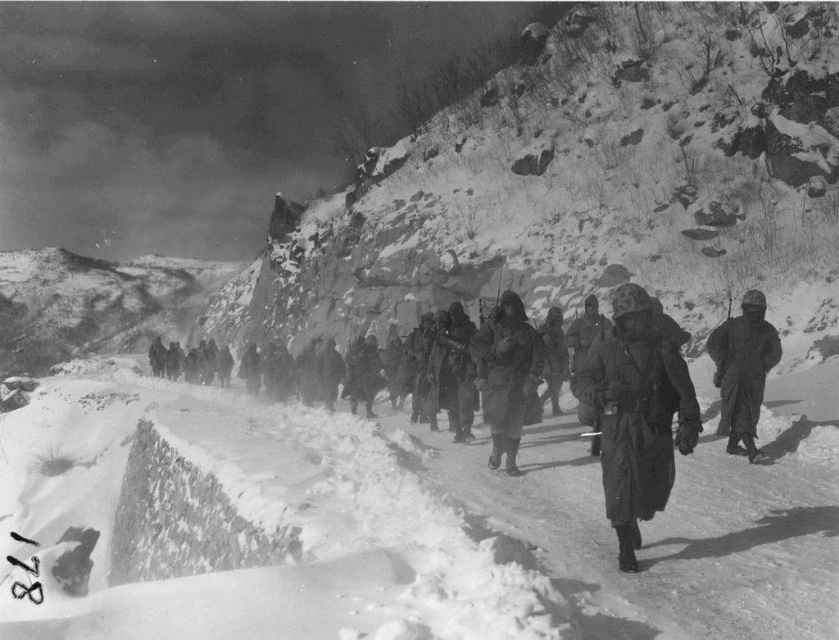
Question: Does white powdery snow at center have a greater width compared to camouflage fabric uniform at center?

Choices:
 (A) yes
 (B) no

Answer: (A)

Question: Does camouflage fabric uniform at center come behind dark gray woolen coat at center?

Choices:
 (A) no
 (B) yes

Answer: (A)

Question: Can you confirm if rocky snow at center is smaller than dark gray woolen coat at center?

Choices:
 (A) no
 (B) yes

Answer: (A)

Question: Estimate the real-world distances between objects in this image. Which object is closer to the camouflage fabric uniform at center?

Choices:
 (A) dark gray woolen coat at center
 (B) rocky snow at center

Answer: (A)

Question: Among these objects, which one is farthest from the camera?

Choices:
 (A) white powdery snow at center
 (B) camouflage fabric uniform at center
 (C) dark gray woolen coat at center

Answer: (C)

Question: Estimate the real-world distances between objects in this image. Which object is closer to the dark gray woolen coat at center?

Choices:
 (A) camouflage fabric uniform at center
 (B) white powdery snow at center
 (C) rocky snow at center

Answer: (A)